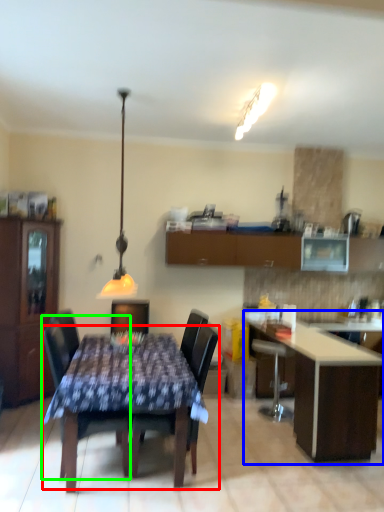
Question: Which is farther away from kitchen & dining room table (highlighted by a red box)? table (highlighted by a blue box) or chair (highlighted by a green box)?

Choices:
 (A) table
 (B) chair

Answer: (A)